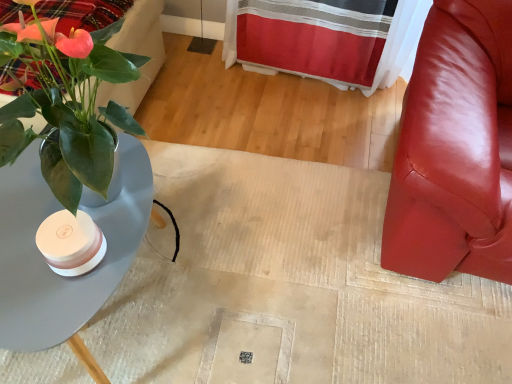
Question: Are green glossy plant at left and glossy leather chair at right located far from each other?

Choices:
 (A) yes
 (B) no

Answer: (B)

Question: Is green glossy plant at left taller than glossy leather chair at right?

Choices:
 (A) no
 (B) yes

Answer: (A)

Question: Is green glossy plant at left facing towards glossy leather chair at right?

Choices:
 (A) yes
 (B) no

Answer: (A)

Question: From a real-world perspective, is green glossy plant at left positioned under glossy leather chair at right based on gravity?

Choices:
 (A) yes
 (B) no

Answer: (A)

Question: From the image's perspective, would you say green glossy plant at left is positioned over glossy leather chair at right?

Choices:
 (A) no
 (B) yes

Answer: (B)

Question: Is point (124, 4) positioned closer to the camera than point (468, 64)?

Choices:
 (A) farther
 (B) closer

Answer: (B)

Question: Based on their sizes in the image, would you say velvet plaid bedding at upper left is bigger or smaller than glossy leather chair at right?

Choices:
 (A) small
 (B) big

Answer: (A)

Question: Is velvet plaid bedding at upper left inside or outside of glossy leather chair at right?

Choices:
 (A) outside
 (B) inside

Answer: (A)

Question: Looking at their shapes, would you say velvet plaid bedding at upper left is wider or thinner than glossy leather chair at right?

Choices:
 (A) thin
 (B) wide

Answer: (A)

Question: In terms of width, does matte white vase at left look wider or thinner when compared to matte gray table at left?

Choices:
 (A) thin
 (B) wide

Answer: (B)

Question: Based on their positions, is matte white vase at left located to the left or right of matte gray table at left?

Choices:
 (A) left
 (B) right

Answer: (B)

Question: From the image's perspective, is matte white vase at left located above or below matte gray table at left?

Choices:
 (A) above
 (B) below

Answer: (B)

Question: From a real-world perspective, is matte white vase at left above or below matte gray table at left?

Choices:
 (A) below
 (B) above

Answer: (A)

Question: Considering the relative positions of matte gray table at left and matte white vase at left in the image provided, is matte gray table at left to the left or to the right of matte white vase at left?

Choices:
 (A) right
 (B) left

Answer: (B)

Question: Is matte gray table at left taller or shorter than matte white vase at left?

Choices:
 (A) tall
 (B) short

Answer: (A)